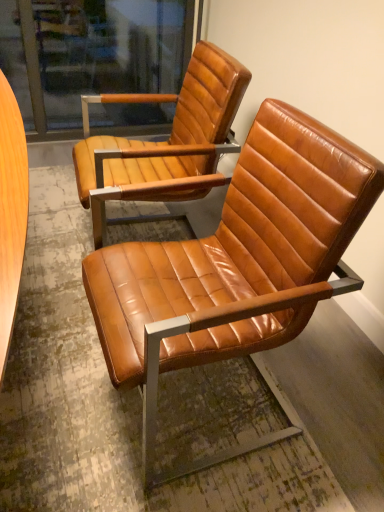
Image resolution: width=384 pixels, height=512 pixels. What do you see at coordinates (165, 141) in the screenshot?
I see `cognac leather chair at center, which appears as the first chair when viewed from the back` at bounding box center [165, 141].

In order to click on cognac leather chair at center, which appears as the first chair when viewed from the back in this screenshot , I will do point(165,141).

The height and width of the screenshot is (512, 384). What do you see at coordinates (236, 263) in the screenshot?
I see `cognac leather chair at center, which appears as the 1th chair when viewed from the front` at bounding box center [236, 263].

At what (x,y) coordinates should I click in order to perform the action: click on cognac leather chair at center, the 2th chair viewed from the back. Please return your answer as a coordinate pair (x, y). This screenshot has width=384, height=512. Looking at the image, I should click on (236, 263).

In order to face cognac leather chair at center, which appears as the 1th chair when viewed from the front, should I rotate leftwards or rightwards?

Turn right approximately 0.999 degrees to face it.

What is the approximate width of cognac leather chair at center, which appears as the 1th chair when viewed from the front?

The width of cognac leather chair at center, which appears as the 1th chair when viewed from the front, is 65.15 centimeters.

In order to click on cognac leather chair at center, which appears as the first chair when viewed from the back in this screenshot , I will do `click(165, 141)`.

Is cognac leather chair at center, positioned as the 2th chair in front-to-back order, at the right side of cognac leather chair at center, the 2th chair viewed from the back?

No.

In the scene shown: Considering the relative positions of cognac leather chair at center, positioned as the 2th chair in front-to-back order, and cognac leather chair at center, the 2th chair viewed from the back, in the image provided, is cognac leather chair at center, positioned as the 2th chair in front-to-back order, behind cognac leather chair at center, the 2th chair viewed from the back,?

Yes, cognac leather chair at center, positioned as the 2th chair in front-to-back order, is behind cognac leather chair at center, the 2th chair viewed from the back.

Does point (209, 98) appear closer or farther from the camera than point (169, 293)?

Clearly, point (209, 98) is more distant from the camera than point (169, 293).

From the image's perspective, is cognac leather chair at center, positioned as the 2th chair in front-to-back order, positioned above or below cognac leather chair at center, the 2th chair viewed from the back?

Based on their image positions, cognac leather chair at center, positioned as the 2th chair in front-to-back order, is located above cognac leather chair at center, the 2th chair viewed from the back.

From a real-world perspective, does cognac leather chair at center, which appears as the first chair when viewed from the back, stand above cognac leather chair at center, which appears as the 1th chair when viewed from the front?

Actually, cognac leather chair at center, which appears as the first chair when viewed from the back, is physically below cognac leather chair at center, which appears as the 1th chair when viewed from the front, in the real world.

Does cognac leather chair at center, positioned as the 2th chair in front-to-back order, have a lesser width compared to cognac leather chair at center, the 2th chair viewed from the back?

Indeed, cognac leather chair at center, positioned as the 2th chair in front-to-back order, has a lesser width compared to cognac leather chair at center, the 2th chair viewed from the back.

Which of these two, cognac leather chair at center, which appears as the first chair when viewed from the back, or cognac leather chair at center, the 2th chair viewed from the back, stands shorter?

Standing shorter between the two is cognac leather chair at center, which appears as the first chair when viewed from the back.

Based on their sizes in the image, would you say cognac leather chair at center, positioned as the 2th chair in front-to-back order, is bigger or smaller than cognac leather chair at center, the 2th chair viewed from the back?

Considering their sizes, cognac leather chair at center, positioned as the 2th chair in front-to-back order, takes up less space than cognac leather chair at center, the 2th chair viewed from the back.

Is cognac leather chair at center, which appears as the first chair when viewed from the back, surrounding cognac leather chair at center, which appears as the 1th chair when viewed from the front?

No, cognac leather chair at center, which appears as the 1th chair when viewed from the front, is located outside of cognac leather chair at center, which appears as the first chair when viewed from the back.

Would you say cognac leather chair at center, which appears as the first chair when viewed from the back, is a long distance from cognac leather chair at center, which appears as the 1th chair when viewed from the front?

No.

Is cognac leather chair at center, positioned as the 2th chair in front-to-back order, looking in the opposite direction of cognac leather chair at center, the 2th chair viewed from the back?

That's not correct — cognac leather chair at center, positioned as the 2th chair in front-to-back order, is not looking away from cognac leather chair at center, the 2th chair viewed from the back.

How much distance is there between cognac leather chair at center, positioned as the 2th chair in front-to-back order, and cognac leather chair at center, which appears as the 1th chair when viewed from the front?

cognac leather chair at center, positioned as the 2th chair in front-to-back order, is 15.74 inches from cognac leather chair at center, which appears as the 1th chair when viewed from the front.

Find the location of a particular element. The height and width of the screenshot is (512, 384). chair on the left of cognac leather chair at center, which appears as the 1th chair when viewed from the front is located at coordinates point(165,141).

Is cognac leather chair at center, the 2th chair viewed from the back, to the right of cognac leather chair at center, which appears as the first chair when viewed from the back, from the viewer's perspective?

Correct, you'll find cognac leather chair at center, the 2th chair viewed from the back, to the right of cognac leather chair at center, which appears as the first chair when viewed from the back.

Does cognac leather chair at center, which appears as the 1th chair when viewed from the front, come in front of cognac leather chair at center, which appears as the first chair when viewed from the back?

Yes, cognac leather chair at center, which appears as the 1th chair when viewed from the front, is closer to the viewer.

Which point is more distant from viewer, (x=222, y=244) or (x=206, y=183)?

Positioned behind is point (x=222, y=244).

From the image's perspective, is cognac leather chair at center, which appears as the 1th chair when viewed from the front, under cognac leather chair at center, positioned as the 2th chair in front-to-back order?

Correct, cognac leather chair at center, which appears as the 1th chair when viewed from the front, appears lower than cognac leather chair at center, positioned as the 2th chair in front-to-back order, in the image.

From a real-world perspective, who is located higher, cognac leather chair at center, the 2th chair viewed from the back, or cognac leather chair at center, which appears as the first chair when viewed from the back?

cognac leather chair at center, the 2th chair viewed from the back, from a real-world perspective.

Considering the relative sizes of cognac leather chair at center, the 2th chair viewed from the back, and cognac leather chair at center, which appears as the first chair when viewed from the back, in the image provided, is cognac leather chair at center, the 2th chair viewed from the back, thinner than cognac leather chair at center, which appears as the first chair when viewed from the back,?

Incorrect, the width of cognac leather chair at center, the 2th chair viewed from the back, is not less than that of cognac leather chair at center, which appears as the first chair when viewed from the back.

Is cognac leather chair at center, which appears as the 1th chair when viewed from the front, shorter than cognac leather chair at center, positioned as the 2th chair in front-to-back order?

No, cognac leather chair at center, which appears as the 1th chair when viewed from the front, is not shorter than cognac leather chair at center, positioned as the 2th chair in front-to-back order.

Is cognac leather chair at center, the 2th chair viewed from the back, bigger or smaller than cognac leather chair at center, which appears as the first chair when viewed from the back?

In the image, cognac leather chair at center, the 2th chair viewed from the back, appears to be larger than cognac leather chair at center, which appears as the first chair when viewed from the back.

Would you say cognac leather chair at center, which appears as the first chair when viewed from the back, is part of cognac leather chair at center, the 2th chair viewed from the back,'s contents?

No, cognac leather chair at center, which appears as the first chair when viewed from the back, is not a part of cognac leather chair at center, the 2th chair viewed from the back.

Are cognac leather chair at center, which appears as the 1th chair when viewed from the front, and cognac leather chair at center, which appears as the first chair when viewed from the back, located far from each other?

cognac leather chair at center, which appears as the 1th chair when viewed from the front, is near cognac leather chair at center, which appears as the first chair when viewed from the back, not far away.

Is cognac leather chair at center, the 2th chair viewed from the back, oriented towards cognac leather chair at center, which appears as the first chair when viewed from the back?

No, cognac leather chair at center, the 2th chair viewed from the back, is not turned towards cognac leather chair at center, which appears as the first chair when viewed from the back.

This screenshot has height=512, width=384. Find the location of `chair on the left of the cognac leather chair at center, which appears as the 1th chair when viewed from the front`. chair on the left of the cognac leather chair at center, which appears as the 1th chair when viewed from the front is located at coordinates (165, 141).

I want to click on chair in front of the cognac leather chair at center, which appears as the first chair when viewed from the back, so click(x=236, y=263).

Where is `chair lying above the cognac leather chair at center, the 2th chair viewed from the back (from the image's perspective)`? The image size is (384, 512). chair lying above the cognac leather chair at center, the 2th chair viewed from the back (from the image's perspective) is located at coordinates (165, 141).